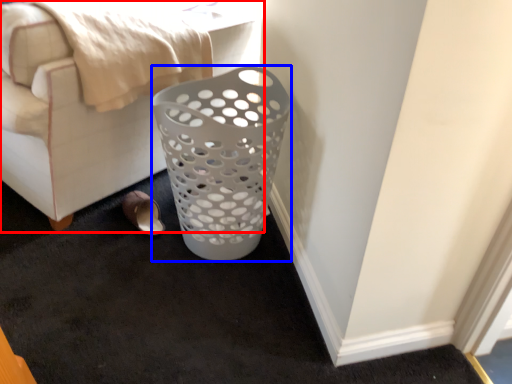
Question: Which point is closer to the camera, furniture (highlighted by a red box) or basket (highlighted by a blue box)?

Choices:
 (A) furniture
 (B) basket

Answer: (A)